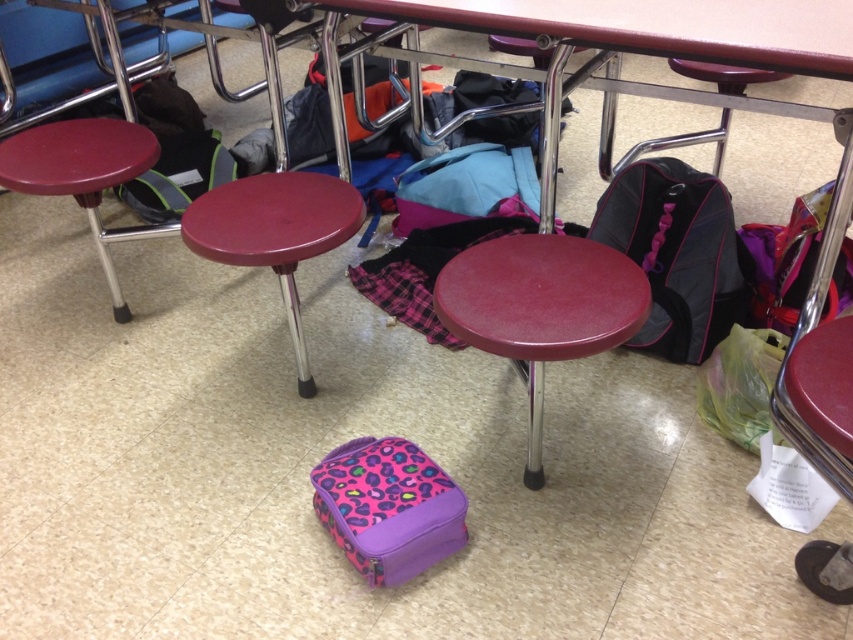
Question: Is purple leopard print lunchbox at center bigger than maroon plastic stool at center?

Choices:
 (A) yes
 (B) no

Answer: (B)

Question: Which object is the farthest from the maroon plastic table at left?

Choices:
 (A) purple leopard print lunchbox at center
 (B) matte blue backpack at center
 (C) maroon plastic stool at center

Answer: (A)

Question: Which point is farther to the camera?

Choices:
 (A) matte plastic stool at center
 (B) maroon plastic stool at center
 (C) black fabric backpack at lower right
 (D) matte blue backpack at center

Answer: (D)

Question: Does maroon plastic stool at center have a smaller size compared to matte blue backpack at center?

Choices:
 (A) yes
 (B) no

Answer: (B)

Question: Is matte plastic stool at center below black fabric backpack at lower right?

Choices:
 (A) no
 (B) yes

Answer: (B)

Question: Which point is closer to the camera?

Choices:
 (A) pyautogui.click(x=315, y=252)
 (B) pyautogui.click(x=514, y=196)
 (C) pyautogui.click(x=38, y=138)
 (D) pyautogui.click(x=456, y=278)

Answer: (D)